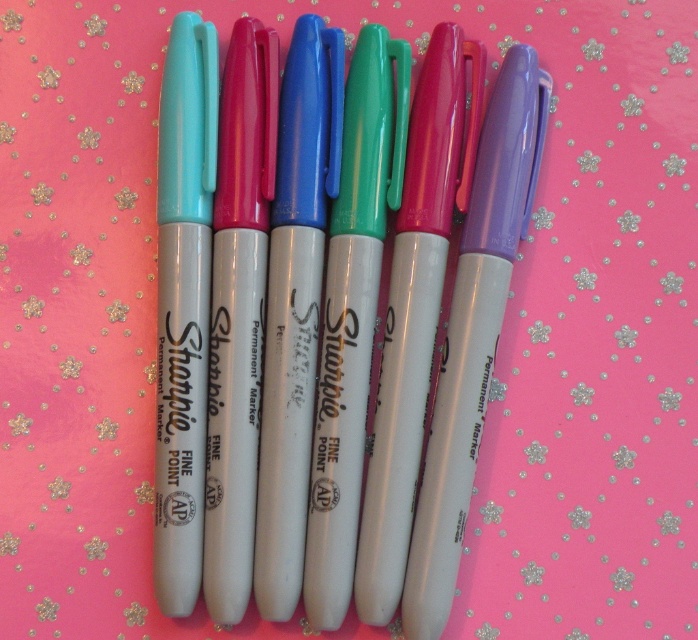
You are standing 1 foot away from the point at point (309, 388). If you walk straight towards the point, how far will you have to walk to reach it?

The distance between you and the point at point (309, 388) is 4.38 feet, so you will have to walk 4.38 feet to reach it.

You are an artist working on a project that requires precise placement of a matte white marker. Based on the scene described, what are the exact coordinates of the matte white marker at center?

The matte white marker at center is located at point (x=364, y=324).

Consider the image. You are an artist setting up your workspace. You have two markers, the matte white marker at center and the matte purple marker at center. If you want to pick up the one that is closer to you, which one should you choose?

The matte white marker at center is closer to the viewer, so you should pick up the matte white marker at center.